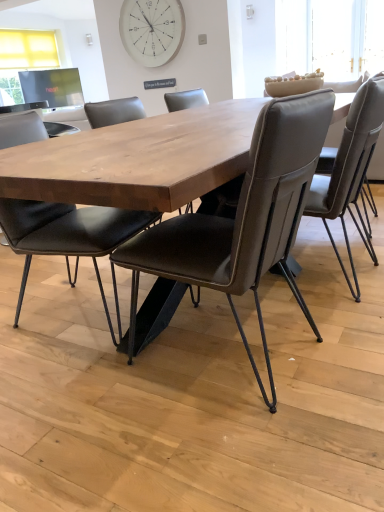
Question: Considering their positions, is matte black chair at center, which ranks as the 3th chair in right-to-left order, located in front of or behind brown leather chair at center, the 2th chair viewed from the left?

Choices:
 (A) behind
 (B) front

Answer: (A)

Question: From a real-world perspective, relative to brown leather chair at center, the 2th chair viewed from the left, is matte black chair at center, positioned as the 1th chair in left-to-right order, vertically above or below?

Choices:
 (A) below
 (B) above

Answer: (A)

Question: Considering the real-world distances, which object is closest to the white wooden clock at upper center?

Choices:
 (A) brown leather chair at center, the 2th chair viewed from the left
 (B) leather-like chair at center, marked as the 1th chair in a right-to-left arrangement
 (C) matte black chair at center, which ranks as the 3th chair in right-to-left order

Answer: (B)

Question: Which is farther from the brown leather chair at center, which is the second chair from right to left?

Choices:
 (A) white wooden clock at upper center
 (B) matte black chair at center, which ranks as the 3th chair in right-to-left order
 (C) leather-like chair at center, the third chair positioned from the left

Answer: (A)